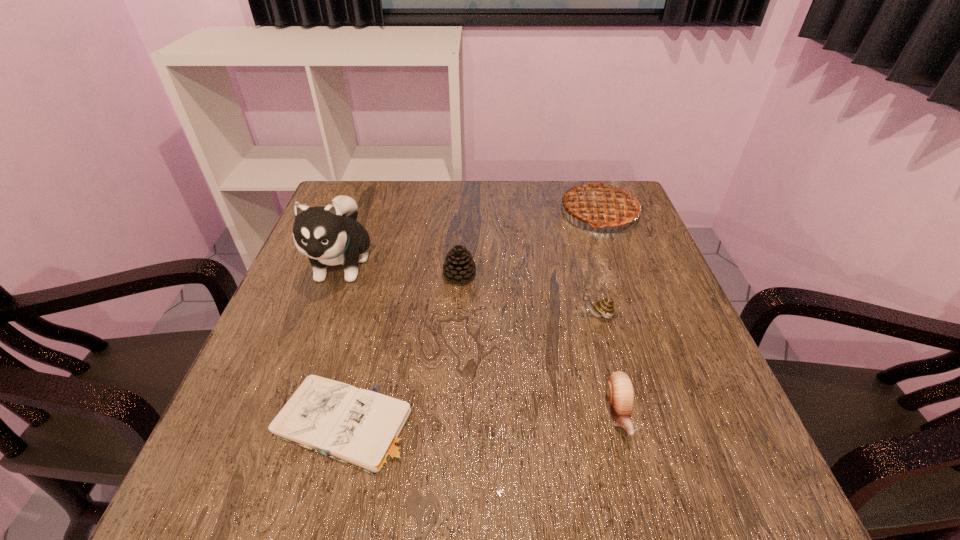
This screenshot has width=960, height=540. I want to click on snail present at the right edge, so click(605, 307).

Locate an element on the screen. This screenshot has width=960, height=540. object that is at the near left corner is located at coordinates (365, 429).

Identify the location of object present at the far right corner. (604, 203).

Identify the location of free space at the far edge. The height and width of the screenshot is (540, 960). (506, 180).

This screenshot has width=960, height=540. Identify the location of free space at the left edge. (311, 312).

Image resolution: width=960 pixels, height=540 pixels. In order to click on vacant area at the right edge in this screenshot , I will do pyautogui.click(x=612, y=239).

Where is `free spot at the far left corner of the desktop`? The height and width of the screenshot is (540, 960). free spot at the far left corner of the desktop is located at coordinates (361, 203).

Where is `vacant space at the far right corner`? This screenshot has width=960, height=540. vacant space at the far right corner is located at coordinates (644, 224).

Find the location of `vacant space at the near right corner`. vacant space at the near right corner is located at coordinates (670, 498).

This screenshot has width=960, height=540. Identify the location of vacant space in between the pinecone and the pie. (529, 245).